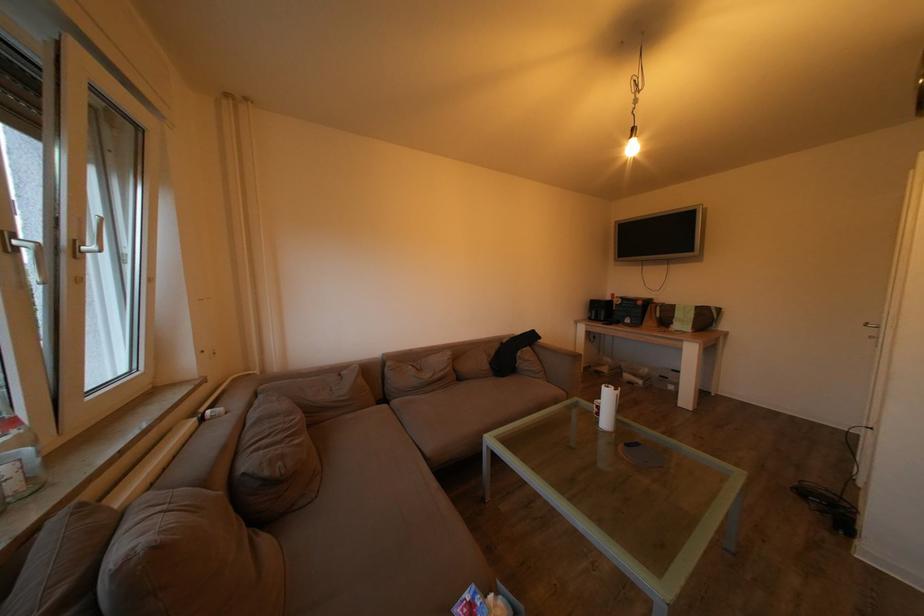
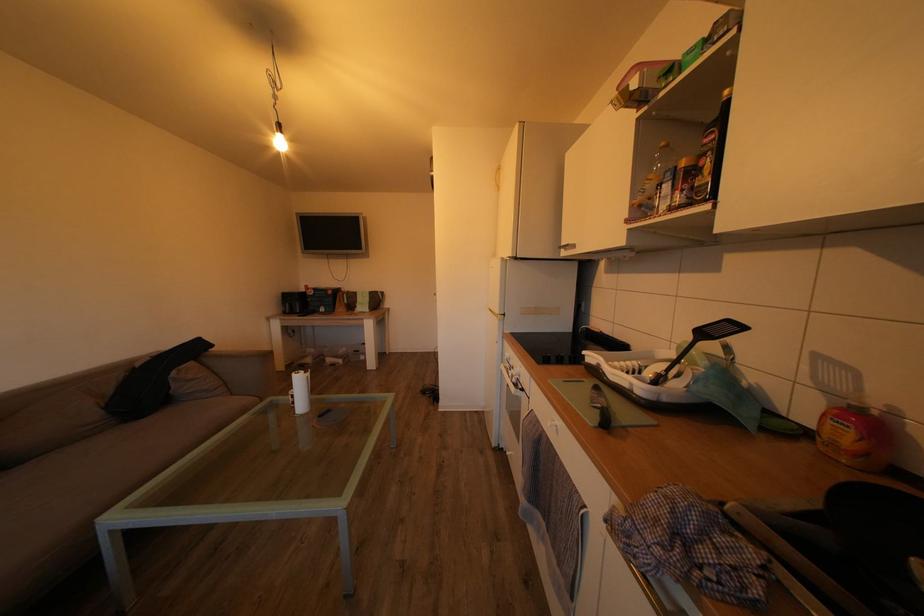
Question: The camera is either moving clockwise (left) or counter-clockwise (right) around the object. The first image is from the beginning of the video and the second image is from the end. Is the camera moving left or right when shooting the video?

Choices:
 (A) Left
 (B) Right

Answer: (A)